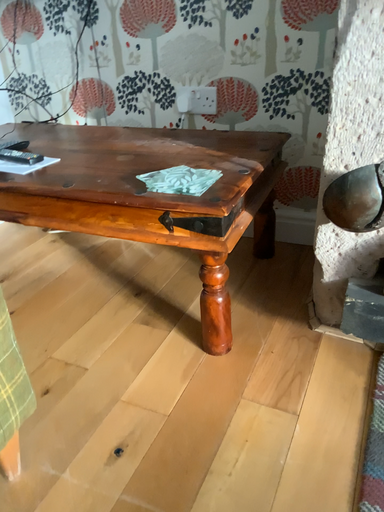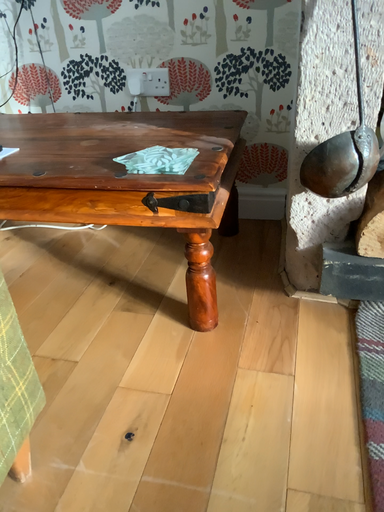
Question: Which way did the camera rotate in the video?

Choices:
 (A) rotated left
 (B) rotated right

Answer: (B)